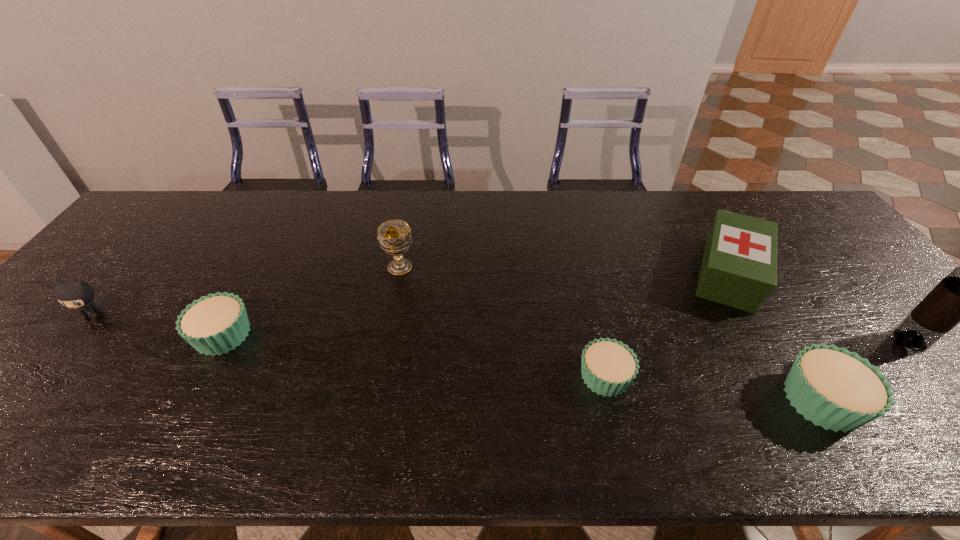
At what (x,y) coordinates should I click in order to perform the action: click on the leftmost cupcake. Please return your answer as a coordinate pair (x, y). Looking at the image, I should click on (216, 323).

Identify the location of the sixth object from right to left. (216, 323).

The image size is (960, 540). I want to click on the shortest cupcake, so click(x=608, y=367).

Find the location of a particular element. The height and width of the screenshot is (540, 960). the second cupcake from left to right is located at coordinates (608, 367).

I want to click on the rightmost cupcake, so click(x=834, y=388).

This screenshot has height=540, width=960. What are the coordinates of `the sixth shortest object` in the screenshot? It's located at (394, 236).

This screenshot has height=540, width=960. Find the location of `chalice`. chalice is located at coordinates (394, 236).

Locate an element on the screen. This screenshot has height=540, width=960. the first-aid kit is located at coordinates (739, 267).

Where is `the leftmost object`? the leftmost object is located at coordinates (76, 294).

I want to click on the rightmost object, so click(x=959, y=297).